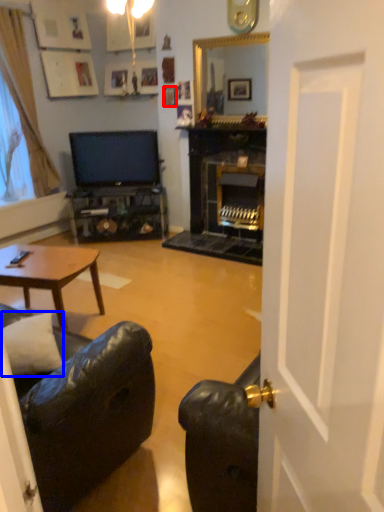
Question: Among these objects, which one is nearest to the camera, picture frame (highlighted by a red box) or pillow (highlighted by a blue box)?

Choices:
 (A) picture frame
 (B) pillow

Answer: (B)